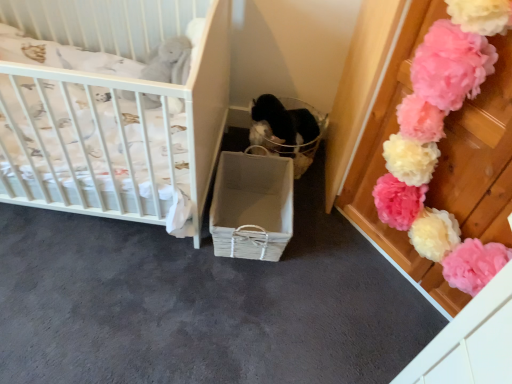
The image size is (512, 384). Identify the location of white wicker basket at center. (252, 206).

The height and width of the screenshot is (384, 512). I want to click on translucent plastic basket at center, so click(x=287, y=129).

You are a GUI agent. You are given a task and a screenshot of the screen. Output one action in this format:
    pyautogui.click(x=<x>, y=<y>)
    Task: Click on the basket behind the white wicker basket at center
    The image size is (512, 384).
    Given the screenshot: What is the action you would take?
    pyautogui.click(x=287, y=129)

Which point is more distant from viewer, (271, 148) or (259, 181)?

Positioned behind is point (271, 148).

Can you confirm if translucent plastic basket at center is shorter than white wicker basket at center?

No, translucent plastic basket at center is not shorter than white wicker basket at center.

Between translucent plastic basket at center and white wicker basket at center, which one appears on the left side from the viewer's perspective?

Positioned to the left is white wicker basket at center.

Is white wicker crib at left aimed at white wicker basket at center?

No, white wicker crib at left is not aimed at white wicker basket at center.

Is point (119, 210) closer or farther from the camera than point (287, 223)?

Point (119, 210) is closer to the camera than point (287, 223).

Considering the relative sizes of white wicker crib at left and white wicker basket at center in the image provided, is white wicker crib at left smaller than white wicker basket at center?

No, white wicker crib at left is not smaller than white wicker basket at center.

Is there a large distance between white wicker crib at left and white wicker basket at center?

Actually, white wicker crib at left and white wicker basket at center are a little close together.

From the image's perspective, which object appears higher, white wicker basket at center or white wicker crib at left?

white wicker crib at left is shown above in the image.

Is white wicker basket at center at the right side of white wicker crib at left?

Indeed, white wicker basket at center is positioned on the right side of white wicker crib at left.

Is white wicker crib at left surrounded by white wicker basket at center?

No, white wicker basket at center does not contain white wicker crib at left.

This screenshot has height=384, width=512. I want to click on crate that appears on the right of white wicker crib at left, so click(x=252, y=206).

You are a GUI agent. You are given a task and a screenshot of the screen. Output one action in this format:
    pyautogui.click(x=<x>, y=<y>)
    Task: Click on the basket that is under the white wicker crib at left (from a real-world perspective)
    The width and height of the screenshot is (512, 384).
    Given the screenshot: What is the action you would take?
    pyautogui.click(x=287, y=129)

Is translucent plastic basket at center placed right next to white wicker crib at left?

No, translucent plastic basket at center is not beside white wicker crib at left.

Considering the relative positions of translucent plastic basket at center and white wicker crib at left in the image provided, is translucent plastic basket at center to the left of white wicker crib at left from the viewer's perspective?

No.

Does translucent plastic basket at center contain white wicker crib at left?

Definitely not — white wicker crib at left is not inside translucent plastic basket at center.

From the image's perspective, would you say pink fluffy pom-pom at upper right is positioned over white wicker crib at left?

No, from the image's perspective, pink fluffy pom-pom at upper right is not on top of white wicker crib at left.

The image size is (512, 384). Find the location of `infant bed that is on the left side of pink fluffy pom-pom at upper right`. infant bed that is on the left side of pink fluffy pom-pom at upper right is located at coordinates (113, 112).

How many degrees apart are the facing directions of pink fluffy pom-pom at upper right and white wicker crib at left?

49.2 degrees separate the facing orientations of pink fluffy pom-pom at upper right and white wicker crib at left.

Considering the relative sizes of pink fluffy pom-pom at upper right and white wicker basket at center in the image provided, is pink fluffy pom-pom at upper right taller than white wicker basket at center?

Yes.

In the scene shown: Is white wicker basket at center surrounded by pink fluffy pom-pom at upper right?

No, white wicker basket at center is not surrounded by pink fluffy pom-pom at upper right.

Considering the positions of objects pink fluffy pom-pom at upper right and white wicker basket at center in the image provided, who is more to the right, pink fluffy pom-pom at upper right or white wicker basket at center?

Positioned to the right is pink fluffy pom-pom at upper right.

What's the angular difference between translucent plastic basket at center and pink fluffy pom-pom at upper right's facing directions?

The angle between the facing direction of translucent plastic basket at center and the facing direction of pink fluffy pom-pom at upper right is 49.4 degrees.

Measure the distance between translucent plastic basket at center and pink fluffy pom-pom at upper right.

translucent plastic basket at center is 29.27 inches from pink fluffy pom-pom at upper right.

Does translucent plastic basket at center have a greater height compared to pink fluffy pom-pom at upper right?

No, translucent plastic basket at center is not taller than pink fluffy pom-pom at upper right.

What are the coordinates of `flower located in front of the translucent plastic basket at center` in the screenshot? It's located at (440, 139).

Locate an element on the screen. basket that is behind the white wicker basket at center is located at coordinates (287, 129).

Identify the location of crate on the right of white wicker crib at left. click(x=252, y=206).

Which object lies nearer to the anchor point white wicker crib at left, white wicker basket at center or pink fluffy pom-pom at upper right?

white wicker basket at center.

Based on their spatial positions, is translucent plastic basket at center or white wicker crib at left further from white wicker basket at center?

white wicker crib at left lies further to white wicker basket at center than the other object.

Based on their spatial positions, is white wicker crib at left or white wicker basket at center further from translucent plastic basket at center?

The object further to translucent plastic basket at center is white wicker crib at left.

Which object lies further to the anchor point white wicker crib at left, translucent plastic basket at center or pink fluffy pom-pom at upper right?

pink fluffy pom-pom at upper right is positioned further to the anchor white wicker crib at left.

From the image, which object appears to be farther from translucent plastic basket at center, white wicker crib at left or pink fluffy pom-pom at upper right?

pink fluffy pom-pom at upper right.

Which object lies nearer to the anchor point translucent plastic basket at center, pink fluffy pom-pom at upper right or white wicker crib at left?

Based on the image, white wicker crib at left appears to be nearer to translucent plastic basket at center.

Estimate the real-world distances between objects in this image. Which object is further from pink fluffy pom-pom at upper right, translucent plastic basket at center or white wicker basket at center?

translucent plastic basket at center is further to pink fluffy pom-pom at upper right.

From the image, which object appears to be nearer to white wicker crib at left, translucent plastic basket at center or white wicker basket at center?

white wicker basket at center.

Where is `crate situated between white wicker crib at left and translucent plastic basket at center from left to right`? The height and width of the screenshot is (384, 512). crate situated between white wicker crib at left and translucent plastic basket at center from left to right is located at coordinates click(252, 206).

Image resolution: width=512 pixels, height=384 pixels. I want to click on crate between pink fluffy pom-pom at upper right and translucent plastic basket at center in the front-back direction, so click(252, 206).

This screenshot has height=384, width=512. Find the location of `crate between white wicker crib at left and pink fluffy pom-pom at upper right from left to right`. crate between white wicker crib at left and pink fluffy pom-pom at upper right from left to right is located at coordinates (252, 206).

You are a GUI agent. You are given a task and a screenshot of the screen. Output one action in this format:
    pyautogui.click(x=<x>, y=<y>)
    Task: Click on the basket between white wicker crib at left and pink fluffy pom-pom at upper right
    The width and height of the screenshot is (512, 384).
    Given the screenshot: What is the action you would take?
    pyautogui.click(x=287, y=129)